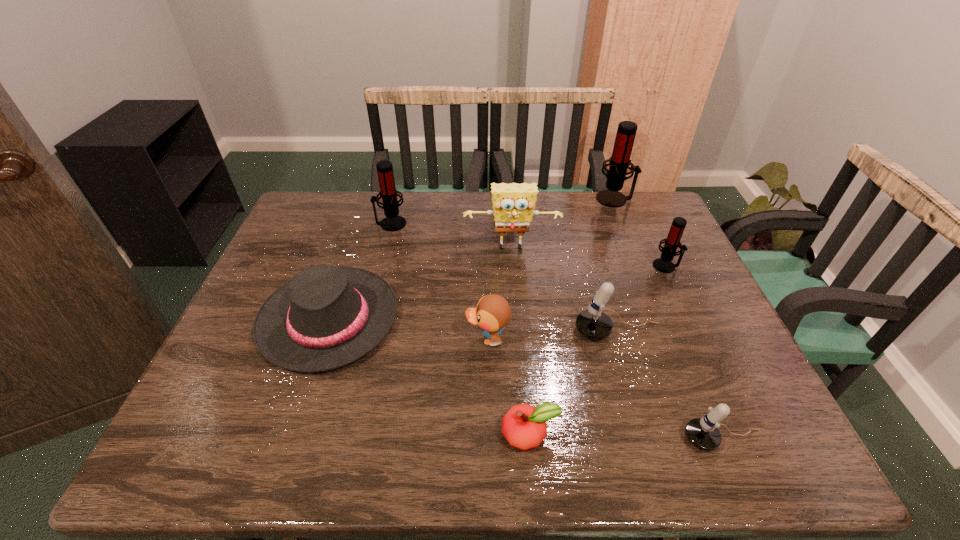
Identify the location of unoccupied area between the smaller white microphone and the duck. Image resolution: width=960 pixels, height=540 pixels. (606, 389).

Where is `empty space that is in between the third nearest microphone and the second farthest red microphone`? The width and height of the screenshot is (960, 540). empty space that is in between the third nearest microphone and the second farthest red microphone is located at coordinates (528, 245).

This screenshot has height=540, width=960. What are the coordinates of `empty space that is in between the smallest red microphone and the farthest microphone` in the screenshot? It's located at [x=640, y=232].

Locate an element on the screen. This screenshot has width=960, height=540. free space between the smallest red microphone and the farthest microphone is located at coordinates (640, 232).

You are a GUI agent. You are given a task and a screenshot of the screen. Output one action in this format:
    pyautogui.click(x=<x>, y=<y>)
    Task: Click on the empty location between the yellow sponge and the third farthest microphone
    Image resolution: width=960 pixels, height=540 pixels.
    Given the screenshot: What is the action you would take?
    pyautogui.click(x=588, y=258)

The width and height of the screenshot is (960, 540). Find the location of `empty space between the tallest object and the dress hat`. empty space between the tallest object and the dress hat is located at coordinates (472, 259).

The height and width of the screenshot is (540, 960). What are the coordinates of `empty space that is in between the second tallest microphone and the third farthest object` in the screenshot? It's located at (451, 237).

Find the location of `free space between the sponge and the farther white microphone`. free space between the sponge and the farther white microphone is located at coordinates (564, 291).

Find the location of a particular element. The height and width of the screenshot is (540, 960). object that is the sixth closest one to the second smallest red microphone is located at coordinates [x=524, y=426].

Locate an element on the screen. the closest object to the shortest microphone is located at coordinates (594, 324).